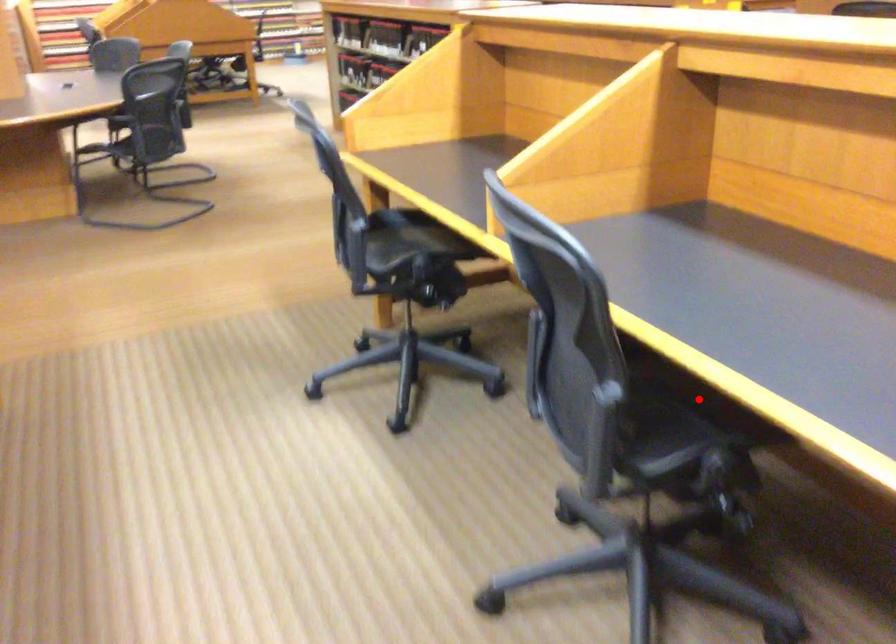
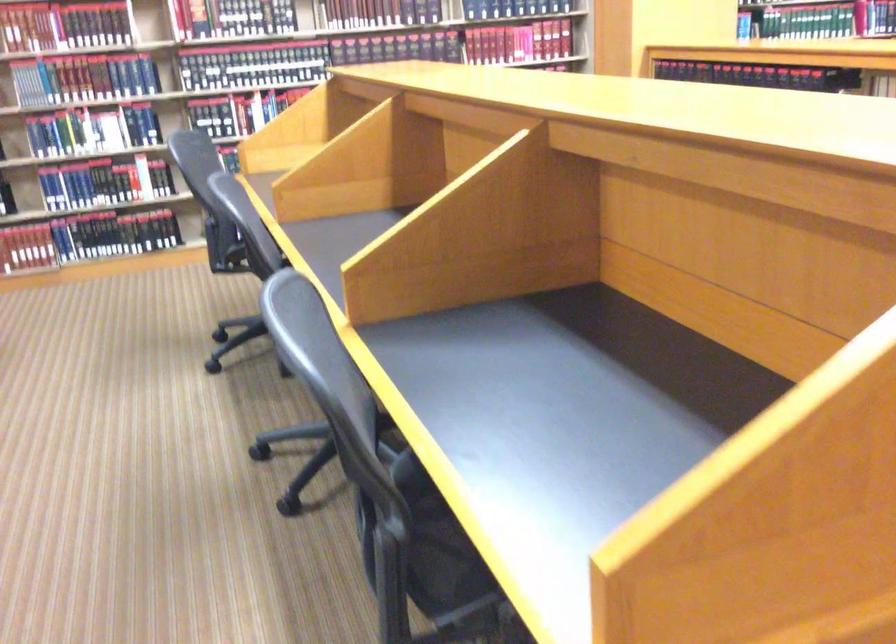
Question: I am providing you with two images of the same scene from different viewpoints. A red point is marked on the first image. At the location where the point appears in image 1, is it still visible in image 2?

Choices:
 (A) Yes
 (B) No

Answer: (B)